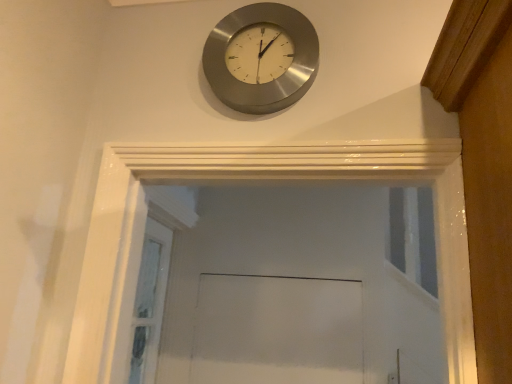
Measure the distance between point (261, 107) and camera.

Point (261, 107) and camera are 1.07 meters apart from each other.

This screenshot has width=512, height=384. What do you see at coordinates (261, 58) in the screenshot? I see `satin silver clock at upper center` at bounding box center [261, 58].

Where is `satin silver clock at upper center`? This screenshot has width=512, height=384. satin silver clock at upper center is located at coordinates (261, 58).

The height and width of the screenshot is (384, 512). In order to click on clear glass screen door at lower left in this screenshot , I will do `click(150, 302)`.

What do you see at coordinates (150, 302) in the screenshot? I see `clear glass screen door at lower left` at bounding box center [150, 302].

Identify the location of satin silver clock at upper center. Image resolution: width=512 pixels, height=384 pixels. (261, 58).

Is clear glass screen door at lower left to the left or to the right of satin silver clock at upper center in the image?

From the image, it's evident that clear glass screen door at lower left is to the left of satin silver clock at upper center.

Considering the positions of objects clear glass screen door at lower left and satin silver clock at upper center in the image provided, who is in front, clear glass screen door at lower left or satin silver clock at upper center?

satin silver clock at upper center.

Considering the positions of points (155, 298) and (255, 88), is point (155, 298) farther from camera compared to point (255, 88)?

Yes, it is.

From the image's perspective, is clear glass screen door at lower left below satin silver clock at upper center?

Indeed, from the image's perspective, clear glass screen door at lower left is shown beneath satin silver clock at upper center.

From a real-world perspective, is clear glass screen door at lower left located higher than satin silver clock at upper center?

Incorrect, from a real-world perspective, clear glass screen door at lower left is lower than satin silver clock at upper center.

In terms of width, does clear glass screen door at lower left look wider or thinner when compared to satin silver clock at upper center?

clear glass screen door at lower left is wider than satin silver clock at upper center.

Is clear glass screen door at lower left taller or shorter than satin silver clock at upper center?

clear glass screen door at lower left is taller than satin silver clock at upper center.

Who is smaller, clear glass screen door at lower left or satin silver clock at upper center?

With smaller size is satin silver clock at upper center.

Which is correct: clear glass screen door at lower left is inside satin silver clock at upper center, or outside of it?

The correct answer is: outside.

Would you consider clear glass screen door at lower left to be distant from satin silver clock at upper center?

clear glass screen door at lower left is far away from satin silver clock at upper center.

Is clear glass screen door at lower left aimed at satin silver clock at upper center?

No, clear glass screen door at lower left is not turned towards satin silver clock at upper center.

How different are the orientations of clear glass screen door at lower left and satin silver clock at upper center in degrees?

90 degrees separate the facing orientations of clear glass screen door at lower left and satin silver clock at upper center.

Locate an element on the screen. wall clock in front of the clear glass screen door at lower left is located at coordinates click(261, 58).

Considering the relative positions of satin silver clock at upper center and clear glass screen door at lower left in the image provided, is satin silver clock at upper center to the left of clear glass screen door at lower left from the viewer's perspective?

Incorrect, satin silver clock at upper center is not on the left side of clear glass screen door at lower left.

Is satin silver clock at upper center closer to camera compared to clear glass screen door at lower left?

Yes, it is.

Which is closer to the camera, [229,84] or [147,270]?

The point [229,84] is closer.

From the image's perspective, between satin silver clock at upper center and clear glass screen door at lower left, which one is located above?

From the image's view, satin silver clock at upper center is above.

Looking at this image, from a real-world perspective, is satin silver clock at upper center physically located above or below clear glass screen door at lower left?

satin silver clock at upper center is situated higher than clear glass screen door at lower left in the real world.

Which of these two, satin silver clock at upper center or clear glass screen door at lower left, is thinner?

satin silver clock at upper center.

In terms of height, does satin silver clock at upper center look taller or shorter compared to clear glass screen door at lower left?

In the image, satin silver clock at upper center appears to be shorter than clear glass screen door at lower left.

Does satin silver clock at upper center have a smaller size compared to clear glass screen door at lower left?

Indeed, satin silver clock at upper center has a smaller size compared to clear glass screen door at lower left.

Is satin silver clock at upper center completely or partially outside of clear glass screen door at lower left?

Absolutely, satin silver clock at upper center is external to clear glass screen door at lower left.

Would you consider satin silver clock at upper center to be distant from clear glass screen door at lower left?

Yes, satin silver clock at upper center and clear glass screen door at lower left are quite far apart.

Could you tell me if satin silver clock at upper center is turned towards clear glass screen door at lower left?

No, satin silver clock at upper center is not aimed at clear glass screen door at lower left.

How many degrees apart are the facing directions of satin silver clock at upper center and clear glass screen door at lower left?

The angular difference between satin silver clock at upper center and clear glass screen door at lower left is 90 degrees.

How much distance is there between satin silver clock at upper center and clear glass screen door at lower left?

satin silver clock at upper center is 3.68 feet away from clear glass screen door at lower left.

Where is `wall clock that is in front of the clear glass screen door at lower left`? wall clock that is in front of the clear glass screen door at lower left is located at coordinates tap(261, 58).

I want to click on wall clock lying in front of the clear glass screen door at lower left, so click(261, 58).

In order to click on screen door on the left side of satin silver clock at upper center in this screenshot , I will do `click(150, 302)`.